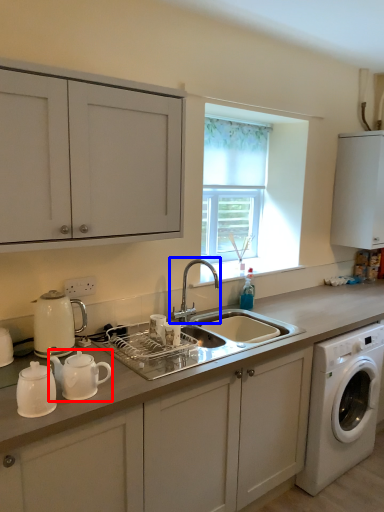
Question: Which point is closer to the camera, tea pot (highlighted by a red box) or tap (highlighted by a blue box)?

Choices:
 (A) tea pot
 (B) tap

Answer: (A)